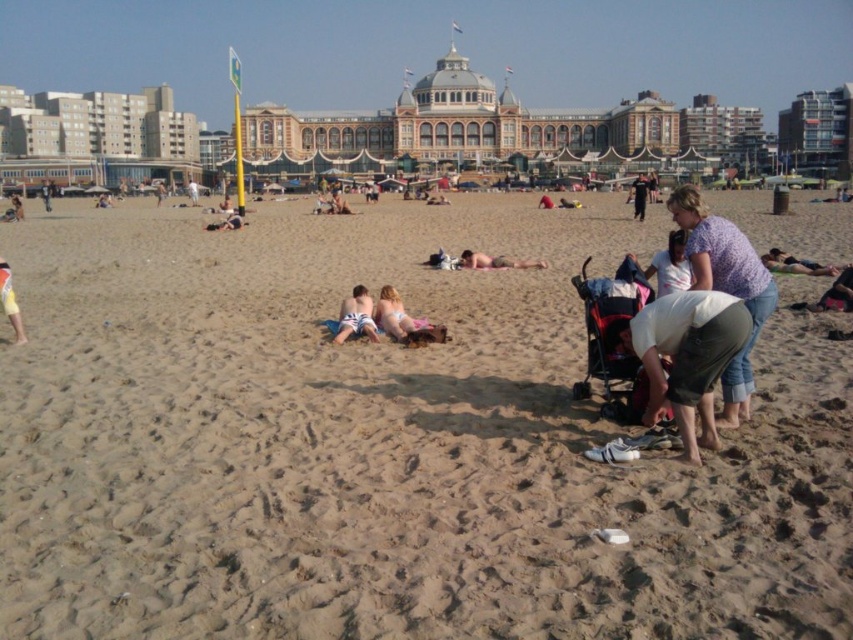
Question: Can you confirm if tan skin person at lower right is smaller than dark blue jeans at center?

Choices:
 (A) no
 (B) yes

Answer: (B)

Question: Does light purple cotton shirt at lower right appear on the left side of tan skin person at lower right?

Choices:
 (A) yes
 (B) no

Answer: (A)

Question: Estimate the real-world distances between objects in this image. Which object is closer to the light yellow fabric at lower left?

Choices:
 (A) smooth tan skin at center
 (B) dark blue jeans at center

Answer: (A)

Question: Among these objects, which one is farthest from the camera?

Choices:
 (A) matte black surfboard at center
 (B) matte pink fabric baby carriage at lower right

Answer: (A)

Question: Which object appears farthest from the camera in this image?

Choices:
 (A) white striped swimsuit at center
 (B) smooth tan skin at center
 (C) matte black surfboard at center

Answer: (C)

Question: Can you confirm if smooth sand at center is positioned to the left of dark blue jeans at center?

Choices:
 (A) no
 (B) yes

Answer: (B)